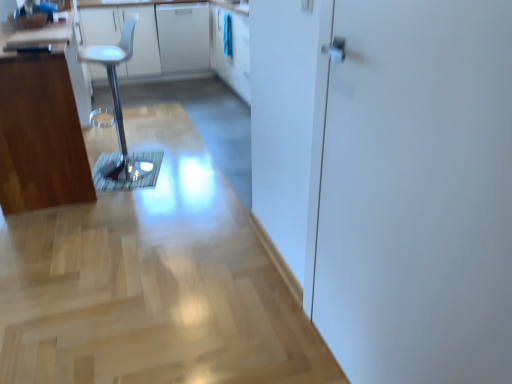
The width and height of the screenshot is (512, 384). I want to click on free space in front of wooden cabinet at left, which is the first cabinetry from front to back, so pyautogui.click(x=75, y=237).